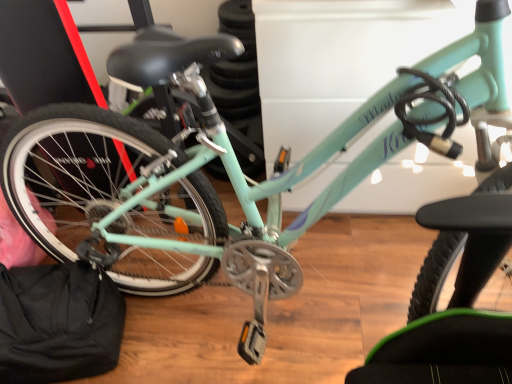
What do you see at coordinates (58, 323) in the screenshot? The width and height of the screenshot is (512, 384). I see `black fabric pouch at lower left` at bounding box center [58, 323].

This screenshot has height=384, width=512. I want to click on black fabric pouch at lower left, so click(58, 323).

You are a GUI agent. You are given a task and a screenshot of the screen. Output one action in this format:
    pyautogui.click(x=<x>, y=<y>)
    Task: Click on the black fabric pouch at lower left
    
    Given the screenshot: What is the action you would take?
    pyautogui.click(x=58, y=323)